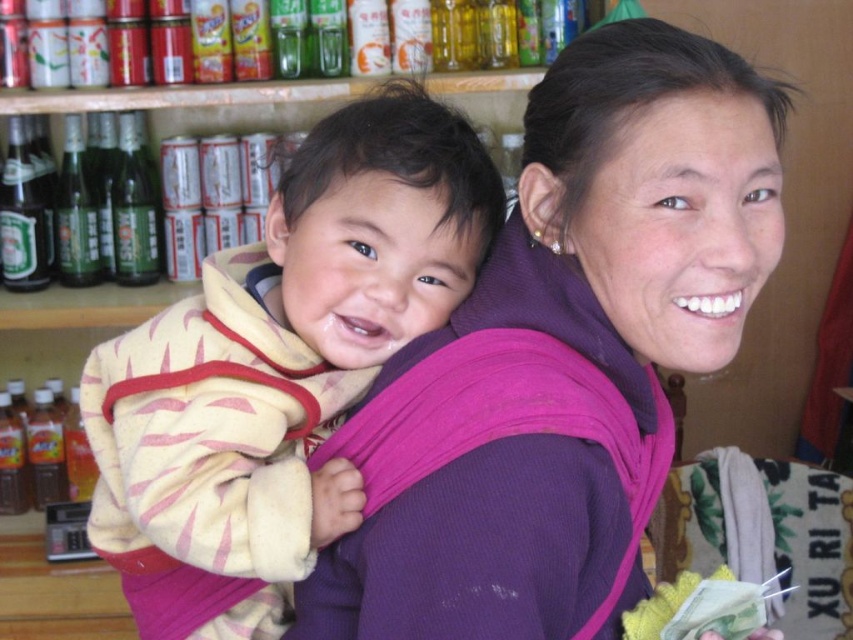
Question: Considering the real-world distances, which object is farthest from the yellow fleece baby at center?

Choices:
 (A) green glass bottle at left
 (B) green glass bottle at upper left

Answer: (A)

Question: Is purple fabric carrier at center in front of green glass bottle at left?

Choices:
 (A) no
 (B) yes

Answer: (B)

Question: Is purple fabric carrier at center bigger than green glass bottle at left?

Choices:
 (A) yes
 (B) no

Answer: (A)

Question: Estimate the real-world distances between objects in this image. Which object is closer to the green glass bottle at left?

Choices:
 (A) purple fabric carrier at center
 (B) green glass bottle at upper left

Answer: (B)

Question: Which of the following is the closest to the observer?

Choices:
 (A) (593, 291)
 (B) (99, 262)
 (C) (216, 611)
 (D) (117, 186)

Answer: (A)

Question: Does purple fabric carrier at center appear on the left side of green glass bottle at left?

Choices:
 (A) no
 (B) yes

Answer: (A)